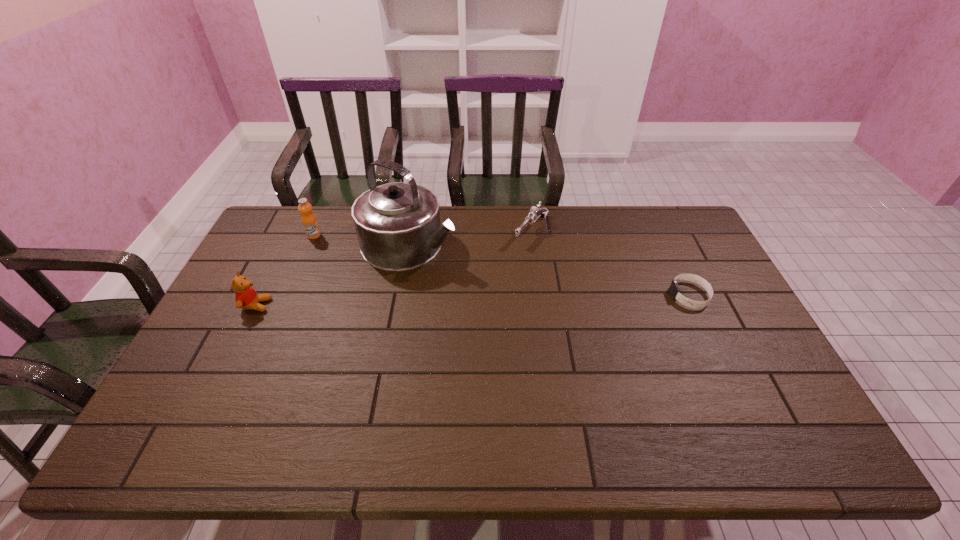
The width and height of the screenshot is (960, 540). What are the coordinates of `vacant space located on the front-facing side of the teddy bear` in the screenshot? It's located at (361, 305).

This screenshot has height=540, width=960. I want to click on free region located 0.230m on the outer surface of the wristband, so click(x=595, y=295).

Locate an element on the screen. vacant space situated on the outer surface of the wristband is located at coordinates point(612,295).

The image size is (960, 540). Identify the location of vacant space situated 0.180m on the outer surface of the wristband. (612, 295).

Locate an element on the screen. Image resolution: width=960 pixels, height=540 pixels. free space located aimed along the barrel of the fourth tallest object is located at coordinates (467, 309).

Find the location of `free region located 0.350m aimed along the barrel of the fourth tallest object`. free region located 0.350m aimed along the barrel of the fourth tallest object is located at coordinates (467, 309).

Where is `vacant space located 0.200m aimed along the barrel of the fourth tallest object`? The width and height of the screenshot is (960, 540). vacant space located 0.200m aimed along the barrel of the fourth tallest object is located at coordinates pyautogui.click(x=492, y=279).

What are the coordinates of `free space located with the spout at the front of the kettle` in the screenshot? It's located at (544, 299).

You are a GUI agent. You are given a task and a screenshot of the screen. Output one action in this format:
    pyautogui.click(x=<x>, y=<y>)
    Task: Click on the blank space located with the spout at the front of the kettle
    The width and height of the screenshot is (960, 540).
    Given the screenshot: What is the action you would take?
    pyautogui.click(x=530, y=293)

At what (x,y) coordinates should I click in order to perform the action: click on vacant area situated 0.240m with the spout at the front of the kettle. Please return your answer as a coordinate pair (x, y). The height and width of the screenshot is (540, 960). Looking at the image, I should click on (513, 286).